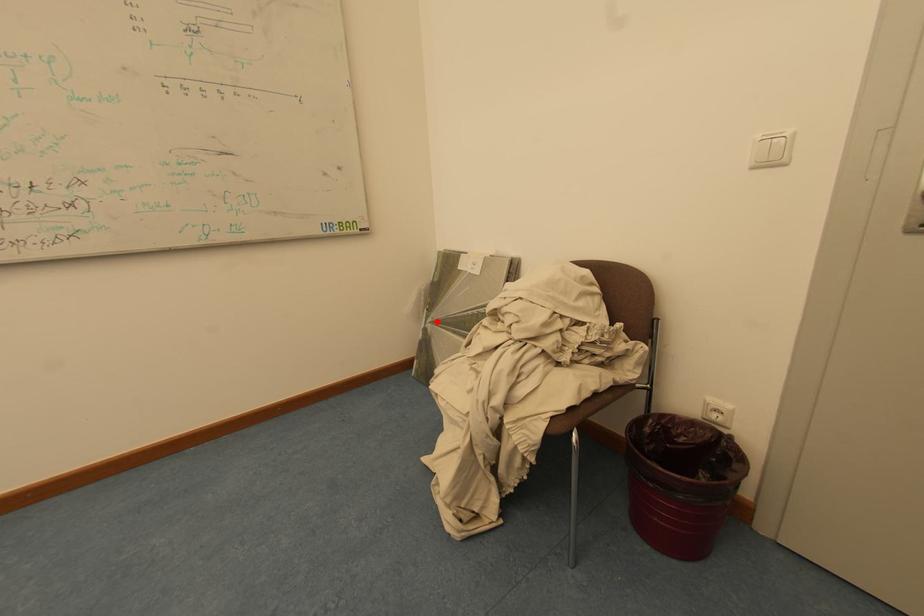
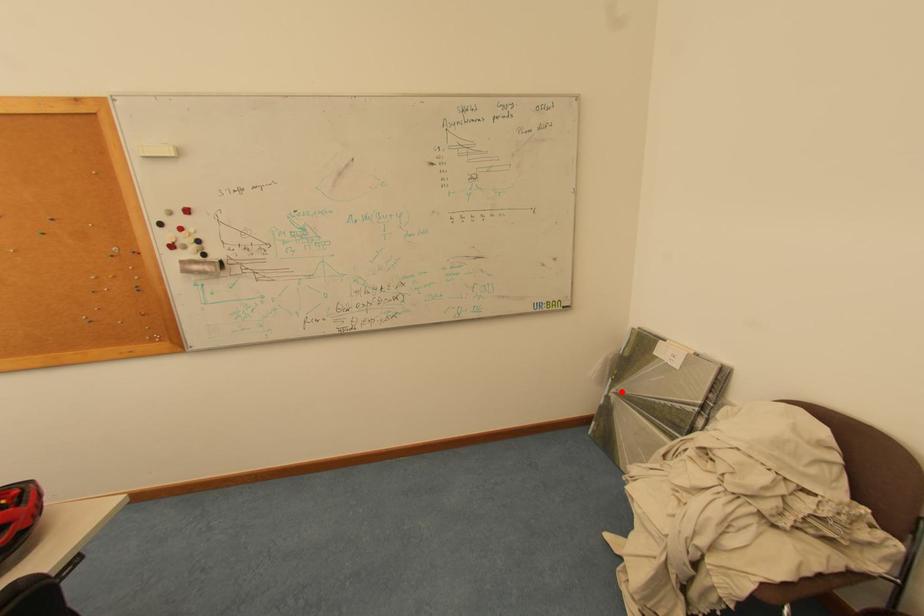
I am providing you with two images of the same scene from different viewpoints. A red point is marked on the first image and another point is marked on the second image. Does the point marked in image1 correspond to the same location as the one in image2?

Yes